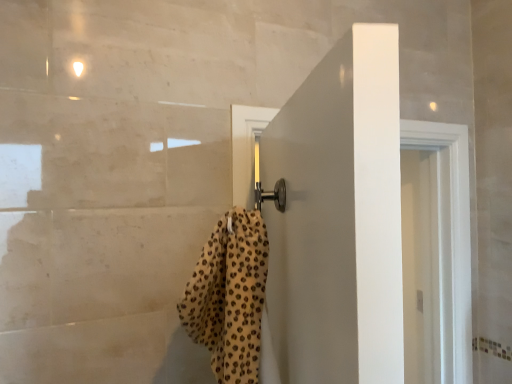
Question: Is white matte door at center located within leopard print towel at center?

Choices:
 (A) yes
 (B) no

Answer: (B)

Question: Can you confirm if leopard print towel at center is thinner than white matte door at center?

Choices:
 (A) yes
 (B) no

Answer: (B)

Question: Is leopard print towel at center beside white matte door at center?

Choices:
 (A) no
 (B) yes

Answer: (A)

Question: Does leopard print towel at center have a smaller size compared to white matte door at center?

Choices:
 (A) yes
 (B) no

Answer: (A)

Question: Can you confirm if leopard print towel at center is wider than white matte door at center?

Choices:
 (A) yes
 (B) no

Answer: (A)

Question: Is leopard print towel at center not inside white matte door at center?

Choices:
 (A) no
 (B) yes

Answer: (B)

Question: From a real-world perspective, is white matte door at center under leopard print towel at center?

Choices:
 (A) no
 (B) yes

Answer: (B)

Question: Is white matte door at center not close to leopard print towel at center?

Choices:
 (A) yes
 (B) no

Answer: (B)

Question: Considering the relative sizes of white matte door at center and leopard print towel at center in the image provided, is white matte door at center thinner than leopard print towel at center?

Choices:
 (A) yes
 (B) no

Answer: (A)

Question: Can you confirm if white matte door at center is wider than leopard print towel at center?

Choices:
 (A) yes
 (B) no

Answer: (B)

Question: Does white matte door at center have a smaller size compared to leopard print towel at center?

Choices:
 (A) yes
 (B) no

Answer: (B)

Question: From the image's perspective, is white matte door at center on leopard print towel at center?

Choices:
 (A) yes
 (B) no

Answer: (B)

Question: From a real-world perspective, relative to white matte door at center, is leopard print towel at center vertically above or below?

Choices:
 (A) above
 (B) below

Answer: (A)